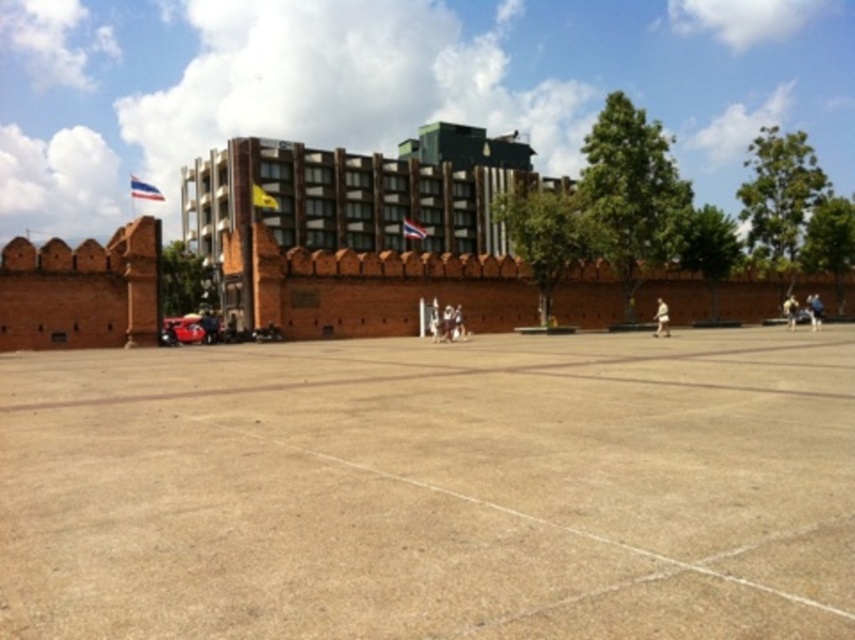
Question: Is yellow fabric flag at center to the right of brown leather jacket at lower right from the viewer's perspective?

Choices:
 (A) yes
 (B) no

Answer: (B)

Question: Which of the following is the closest to the observer?

Choices:
 (A) yellow fabric flag at center
 (B) white fabric person at center
 (C) blue fabric person at center

Answer: (B)

Question: Which of the following is the closest to the observer?

Choices:
 (A) blue fabric flag at upper left
 (B) white fabric person at center
 (C) matte yellow flag at center

Answer: (B)

Question: Observing the image, what is the correct spatial positioning of brick wall hotel at center in reference to light brown leather jacket at center?

Choices:
 (A) below
 (B) above

Answer: (B)

Question: Is brown concrete plaza at center to the right of blue fabric person at center from the viewer's perspective?

Choices:
 (A) yes
 (B) no

Answer: (B)

Question: Which object is the closest to the brick wall at center?

Choices:
 (A) brown leather jacket at lower right
 (B) white fabric person at center

Answer: (B)